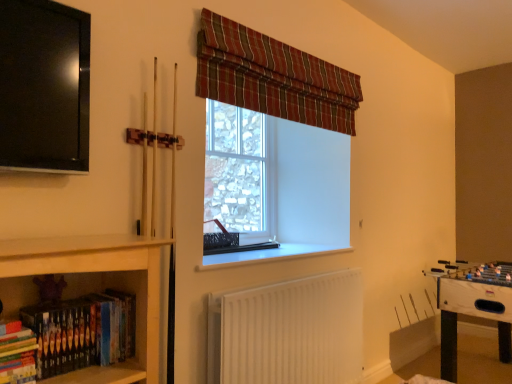
Question: Can clear glass window at center be found inside hardcover books at lower left, acting as the 2th book starting from the right?

Choices:
 (A) yes
 (B) no

Answer: (B)

Question: Does hardcover books at lower left, arranged as the first book when viewed from the left, come behind clear glass window at center?

Choices:
 (A) yes
 (B) no

Answer: (B)

Question: Is hardcover books at lower left, arranged as the first book when viewed from the left, positioned far away from clear glass window at center?

Choices:
 (A) yes
 (B) no

Answer: (A)

Question: Is hardcover books at lower left, acting as the 2th book starting from the right, to the right of clear glass window at center from the viewer's perspective?

Choices:
 (A) no
 (B) yes

Answer: (A)

Question: Does hardcover books at lower left, acting as the 2th book starting from the right, have a greater height compared to clear glass window at center?

Choices:
 (A) no
 (B) yes

Answer: (A)

Question: Is point (105, 331) positioned closer to the camera than point (345, 288)?

Choices:
 (A) closer
 (B) farther

Answer: (A)

Question: Considering the relative positions of hardcover books at lower left, the first book in the right-to-left sequence, and white ribbed radiator at lower center in the image provided, is hardcover books at lower left, the first book in the right-to-left sequence, to the left or to the right of white ribbed radiator at lower center?

Choices:
 (A) right
 (B) left

Answer: (B)

Question: Considering the positions of hardcover books at lower left, which appears as the second book when viewed from the left, and white ribbed radiator at lower center in the image, is hardcover books at lower left, which appears as the second book when viewed from the left, taller or shorter than white ribbed radiator at lower center?

Choices:
 (A) short
 (B) tall

Answer: (A)

Question: Considering their positions, is hardcover books at lower left, the first book in the right-to-left sequence, located in front of or behind white ribbed radiator at lower center?

Choices:
 (A) behind
 (B) front

Answer: (B)

Question: Looking at their shapes, would you say plaid fabric curtain at upper center is wider or thinner than white ribbed radiator at lower center?

Choices:
 (A) wide
 (B) thin

Answer: (B)

Question: From their relative heights in the image, would you say plaid fabric curtain at upper center is taller or shorter than white ribbed radiator at lower center?

Choices:
 (A) short
 (B) tall

Answer: (A)

Question: Which is correct: plaid fabric curtain at upper center is inside white ribbed radiator at lower center, or outside of it?

Choices:
 (A) outside
 (B) inside

Answer: (A)

Question: In terms of size, does plaid fabric curtain at upper center appear bigger or smaller than white ribbed radiator at lower center?

Choices:
 (A) big
 (B) small

Answer: (B)

Question: Considering the positions of plaid fabric curtain at upper center and clear glass window at center in the image, is plaid fabric curtain at upper center wider or thinner than clear glass window at center?

Choices:
 (A) wide
 (B) thin

Answer: (B)

Question: Is plaid fabric curtain at upper center spatially inside clear glass window at center, or outside of it?

Choices:
 (A) outside
 (B) inside

Answer: (A)